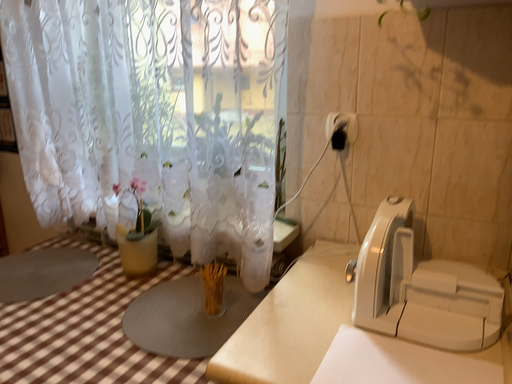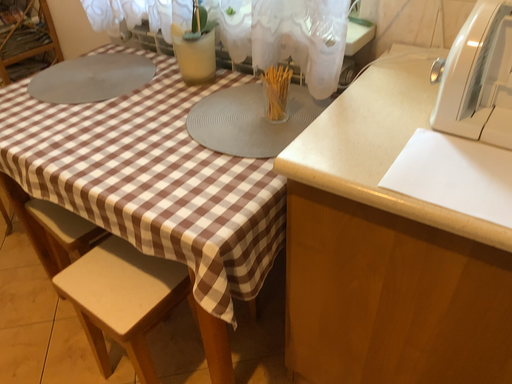
Question: Which way did the camera rotate in the video?

Choices:
 (A) rotated right
 (B) rotated left

Answer: (B)